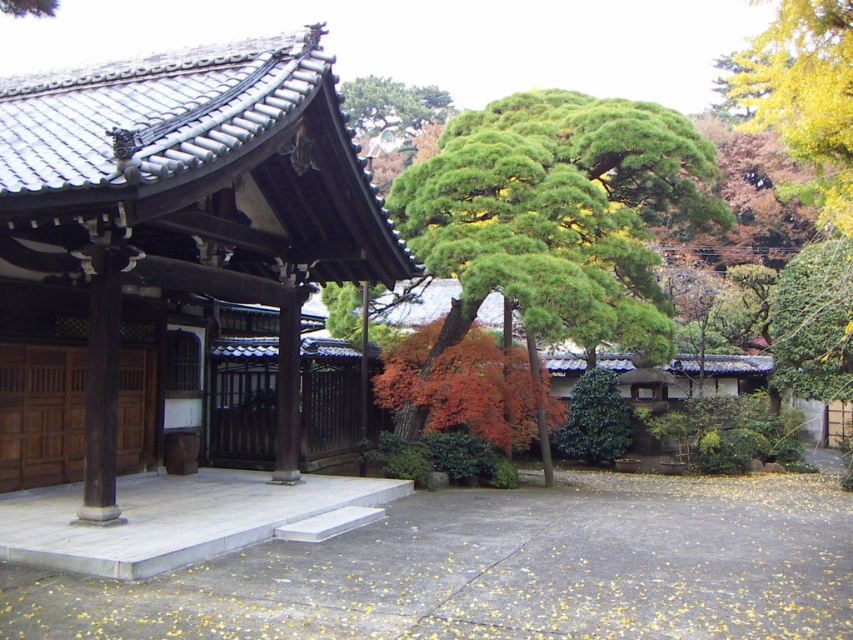
Is yellow/golden/yellowish-green leafy tree at upper right smaller than green textured tree at upper center?

No, yellow/golden/yellowish-green leafy tree at upper right is not smaller than green textured tree at upper center.

Between point (759, 92) and point (346, 97), which one is positioned in front?

Point (759, 92) is more forward.

Between point (782, 67) and point (387, 138), which one is positioned behind?

Positioned behind is point (387, 138).

The height and width of the screenshot is (640, 853). In order to click on yellow/golden/yellowish-green leafy tree at upper right in this screenshot , I will do `click(804, 93)`.

Is green needle-like at center thinner than yellow/golden/yellowish-green leafy tree at upper right?

Yes.

Does green needle-like at center have a greater width compared to yellow/golden/yellowish-green leafy tree at upper right?

In fact, green needle-like at center might be narrower than yellow/golden/yellowish-green leafy tree at upper right.

What do you see at coordinates (558, 214) in the screenshot? This screenshot has height=640, width=853. I see `green needle-like at center` at bounding box center [558, 214].

This screenshot has width=853, height=640. Find the location of `green needle-like at center`. green needle-like at center is located at coordinates (558, 214).

Who is lower down, green needle-like at center or green textured tree at upper center?

Positioned lower is green needle-like at center.

Can you confirm if green needle-like at center is thinner than green textured tree at upper center?

No.

At what (x,y) coordinates should I click in order to perform the action: click on green needle-like at center. Please return your answer as a coordinate pair (x, y). Looking at the image, I should click on (558, 214).